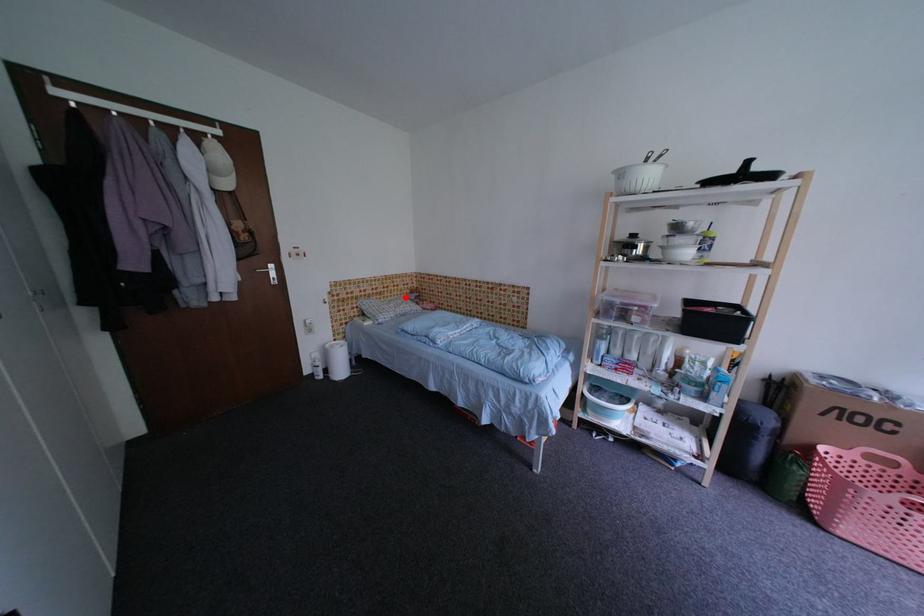
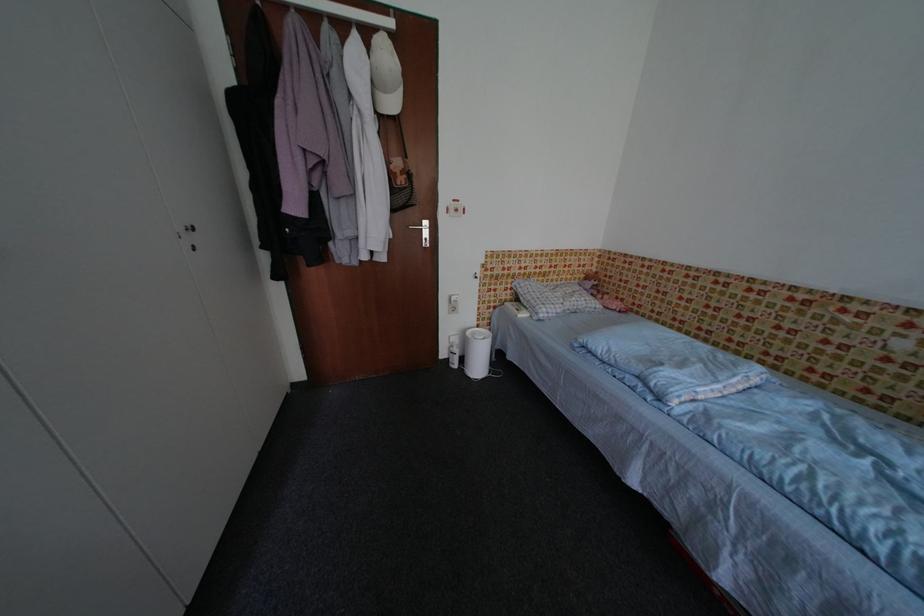
The point at the highlighted location is marked in the first image. Where is the corresponding point in the second image?

(574, 282)